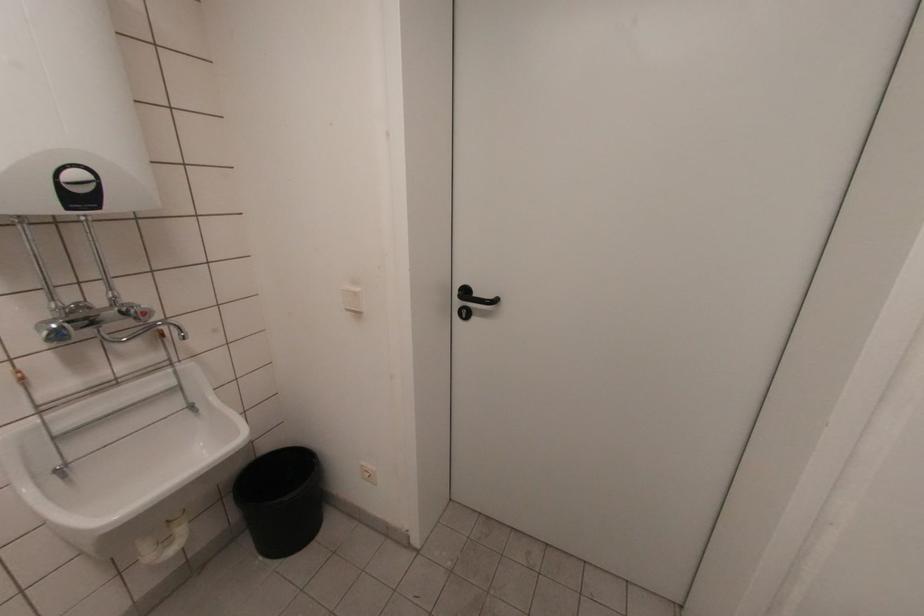
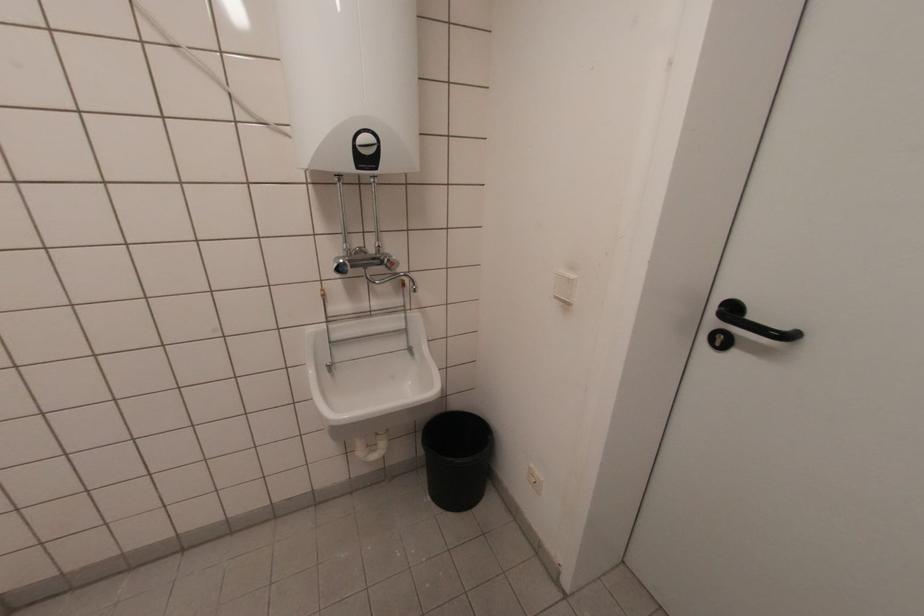
Locate, in the second image, the point that corresponds to point 123,304 in the first image.

(383, 254)